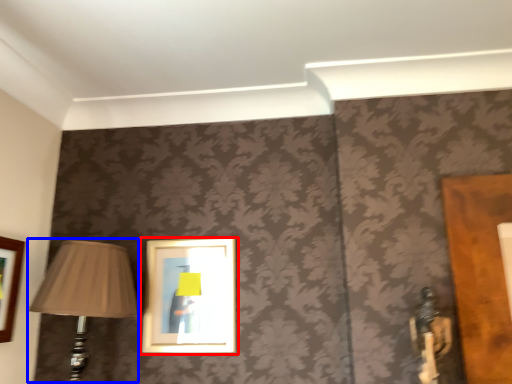
Question: Which object appears farthest to the camera in this image, picture frame (highlighted by a red box) or lamp (highlighted by a blue box)?

Choices:
 (A) picture frame
 (B) lamp

Answer: (A)